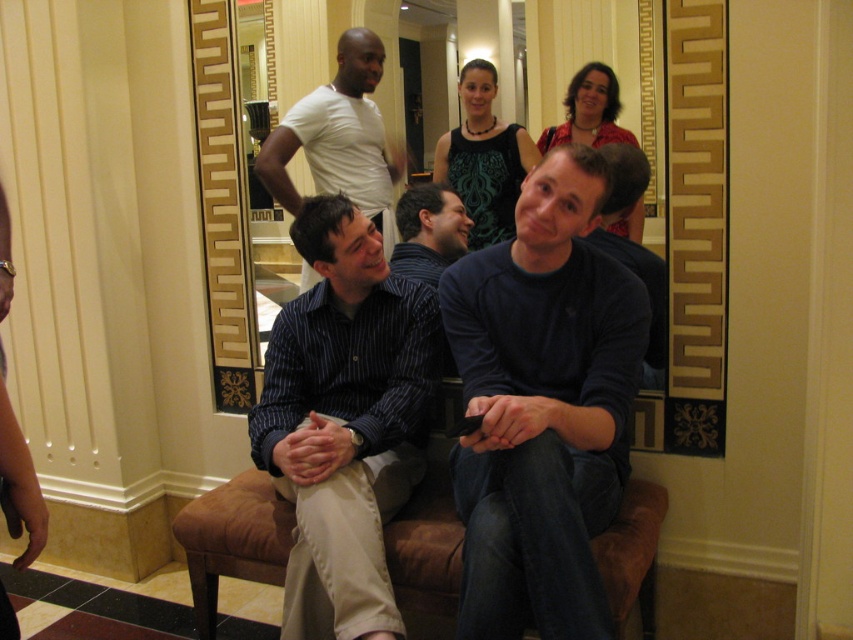
Question: Does dark blue sweater at center appear over striped shirt at center?

Choices:
 (A) yes
 (B) no

Answer: (B)

Question: Considering the real-world distances, which object is farthest from the dark blue sweater at center?

Choices:
 (A) white matte t-shirt at upper center
 (B) blue striped shirt at center

Answer: (A)

Question: Which object is farther from the camera taking this photo?

Choices:
 (A) striped shirt at center
 (B) dark blue sweater at center
 (C) blue striped shirt at center

Answer: (A)

Question: Is dark blue sweater at center bigger than striped shirt at center?

Choices:
 (A) yes
 (B) no

Answer: (A)

Question: Is dark blue sweater at center thinner than blue striped shirt at center?

Choices:
 (A) yes
 (B) no

Answer: (A)

Question: Considering the real-world distances, which object is closest to the dark blue sweater at center?

Choices:
 (A) white matte t-shirt at upper center
 (B) blue striped shirt at center

Answer: (B)